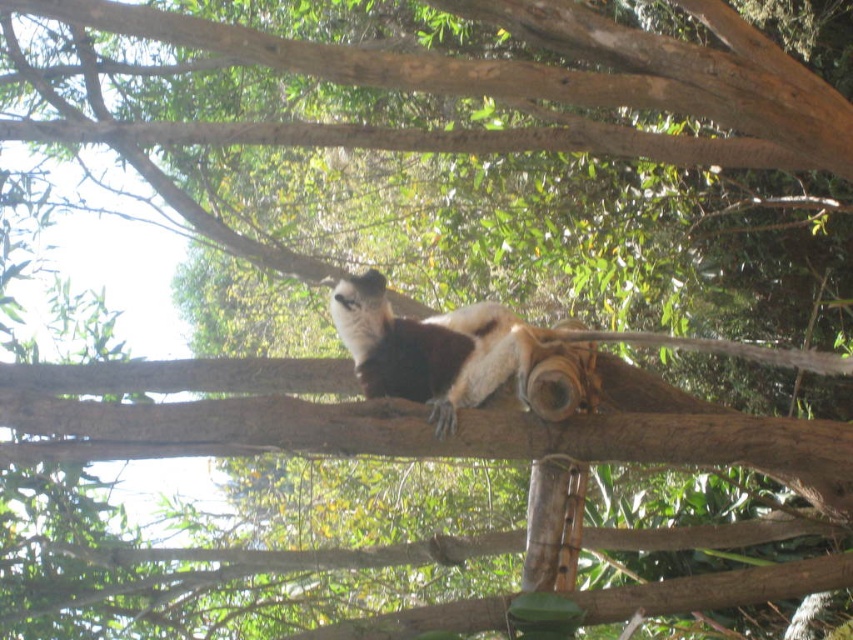
Question: Among these objects, which one is farthest from the camera?

Choices:
 (A) brown fur monkey at center
 (B) brown rough tree branch at upper center

Answer: (A)

Question: Does brown rough tree branch at upper center have a lesser width compared to brown fur monkey at center?

Choices:
 (A) yes
 (B) no

Answer: (B)

Question: Among these points, which one is nearest to the camera?

Choices:
 (A) (126, 4)
 (B) (358, 301)

Answer: (A)

Question: Can you confirm if brown rough tree branch at upper center is positioned to the right of brown fur monkey at center?

Choices:
 (A) no
 (B) yes

Answer: (A)

Question: Which point is farther from the camera taking this photo?

Choices:
 (A) (706, 1)
 (B) (451, 406)

Answer: (A)

Question: Does brown rough tree branch at upper center have a larger size compared to brown fur monkey at center?

Choices:
 (A) no
 (B) yes

Answer: (B)